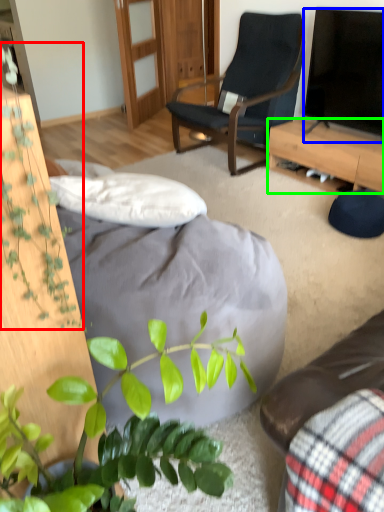
Question: Considering the real-world distances, which object is farthest from vegetation (highlighted by a red box)? television (highlighted by a blue box) or desk (highlighted by a green box)?

Choices:
 (A) television
 (B) desk

Answer: (A)